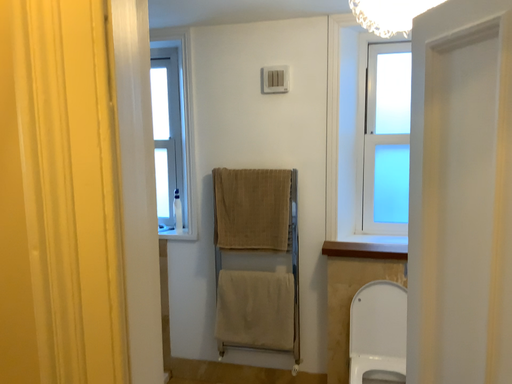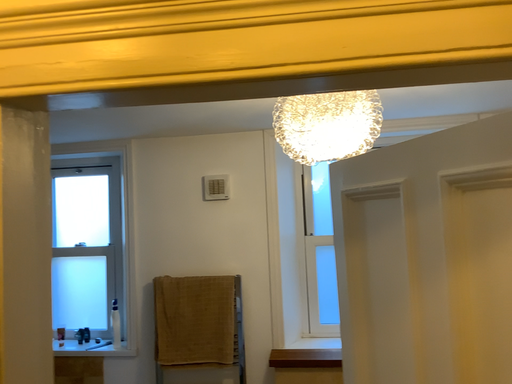
Question: How did the camera likely rotate when shooting the video?

Choices:
 (A) rotated right
 (B) rotated left

Answer: (A)